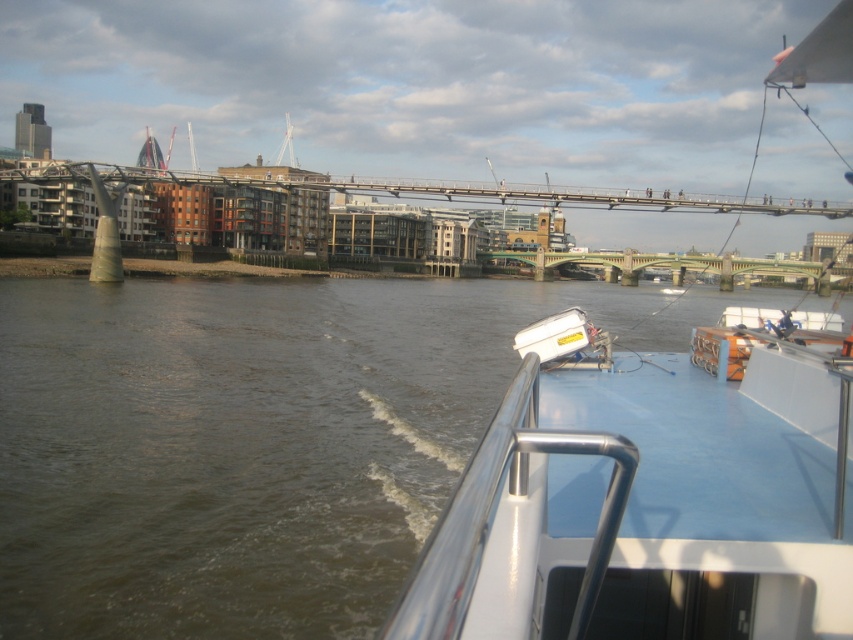
Question: Which point is farther from the camera taking this photo?

Choices:
 (A) click(587, 547)
 (B) click(540, 276)

Answer: (B)

Question: Is brown water at lower left bigger than green metallic bridge at center?

Choices:
 (A) yes
 (B) no

Answer: (B)

Question: Does brown water at lower left have a lesser width compared to green metallic bridge at center?

Choices:
 (A) no
 (B) yes

Answer: (B)

Question: Which of the following is the farthest from the observer?

Choices:
 (A) (689, 268)
 (B) (38, 417)
 (C) (834, 54)

Answer: (A)

Question: Which is farther from the brown water at lower left?

Choices:
 (A) white plastic boat at center
 (B) green metallic bridge at center

Answer: (B)

Question: Can you confirm if brown water at lower left is thinner than green metallic bridge at center?

Choices:
 (A) yes
 (B) no

Answer: (A)